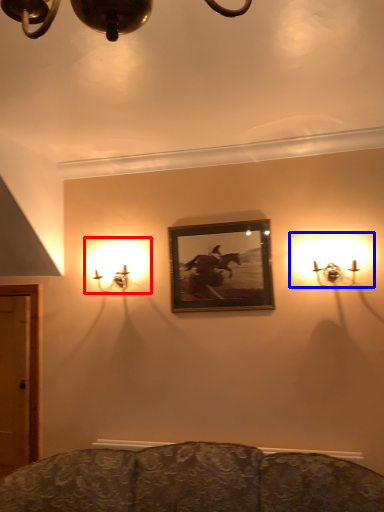
Question: Which of the following is the closest to the observer, lamp (highlighted by a red box) or lamp (highlighted by a blue box)?

Choices:
 (A) lamp
 (B) lamp

Answer: (B)